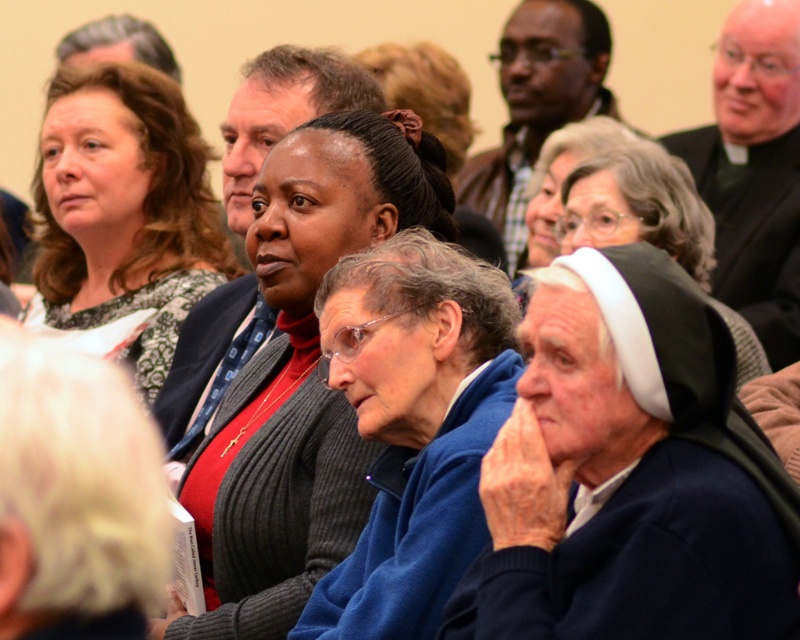
Is matte black sweater at upper left below matte black jacket at upper center?

Yes, matte black sweater at upper left is below matte black jacket at upper center.

Which is above, matte black sweater at upper left or matte black jacket at upper center?

matte black jacket at upper center

Identify the location of matte black sweater at upper left. (124, 212).

Does knitted sweater at center appear over black velvet robe at upper right?

Incorrect, knitted sweater at center is not positioned above black velvet robe at upper right.

Does knitted sweater at center come behind black velvet robe at upper right?

No, it is in front of black velvet robe at upper right.

Between point (226, 531) and point (766, 74), which one is positioned in front?

Point (226, 531) is in front.

Where is `knitted sweater at center`? Image resolution: width=800 pixels, height=640 pixels. knitted sweater at center is located at coordinates (300, 374).

Which is in front, point (346, 150) or point (86, 145)?

Point (346, 150)

Find the location of a particular element. knitted sweater at center is located at coordinates (300, 374).

You are a GUI agent. You are given a task and a screenshot of the screen. Output one action in this format:
    pyautogui.click(x=<x>, y=<y>)
    Task: Click on the knitted sweater at center
    This screenshot has width=800, height=640.
    Given the screenshot: What is the action you would take?
    pyautogui.click(x=300, y=374)